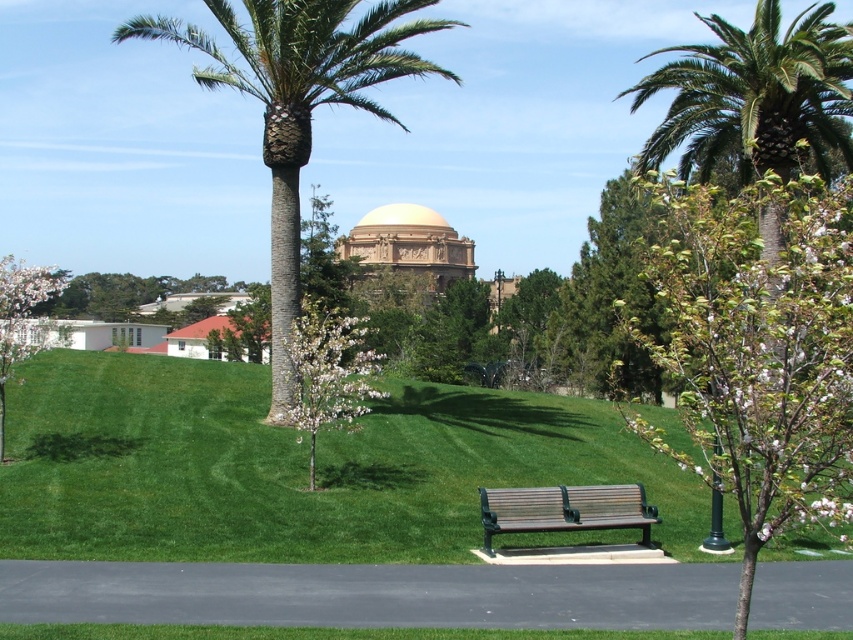
Between green leafy tree at center and wooden bench at center, which one appears on the left side from the viewer's perspective?

wooden bench at center

Which is above, green leafy tree at center or wooden bench at center?

green leafy tree at center

Does point (817, 412) come farther from viewer compared to point (622, 515)?

No, it is not.

The width and height of the screenshot is (853, 640). What are the coordinates of `green leafy tree at center` in the screenshot? It's located at (759, 348).

Who is lower down, green textured palm tree at center or green leafy palm tree at upper right?

green textured palm tree at center

Does green textured palm tree at center have a greater width compared to green leafy palm tree at upper right?

Answer: Indeed, green textured palm tree at center has a greater width compared to green leafy palm tree at upper right.

Which is behind, point (318, 26) or point (747, 118)?

The point (747, 118) is more distant.

Find the location of a particular element. This screenshot has width=853, height=640. green textured palm tree at center is located at coordinates (299, 106).

Is green grass at center wider than white blossoming tree at lower left?

No, green grass at center is not wider than white blossoming tree at lower left.

Can you confirm if green grass at center is bigger than white blossoming tree at lower left?

Actually, green grass at center might be smaller than white blossoming tree at lower left.

Which is behind, point (276, 547) or point (56, 278)?

Positioned behind is point (56, 278).

What are the coordinates of `green grass at center` in the screenshot? It's located at (292, 467).